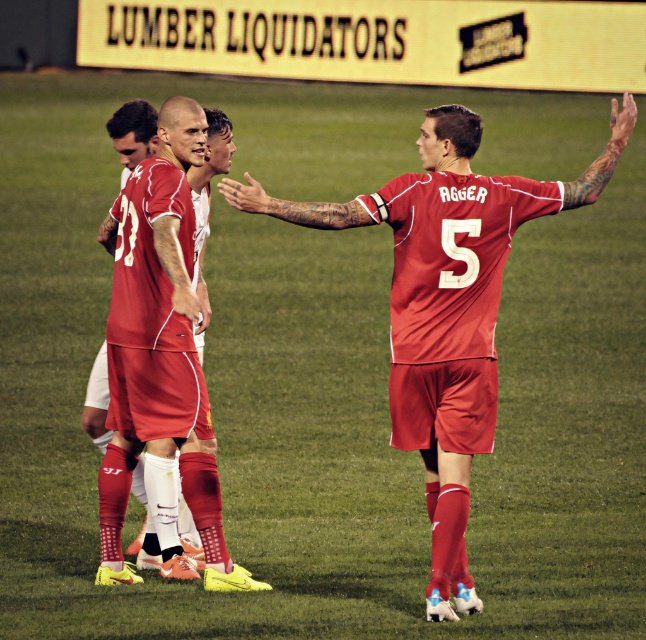
Does matte red jersey at center have a lesser height compared to matte red soccer uniform at center?

In fact, matte red jersey at center may be taller than matte red soccer uniform at center.

Does point (488, 193) lie behind point (120, 572)?

No, it is not.

At what (x,y) coordinates should I click in order to perform the action: click on matte red jersey at center. Please return your answer as a coordinate pair (x, y). Image resolution: width=646 pixels, height=640 pixels. Looking at the image, I should click on (446, 305).